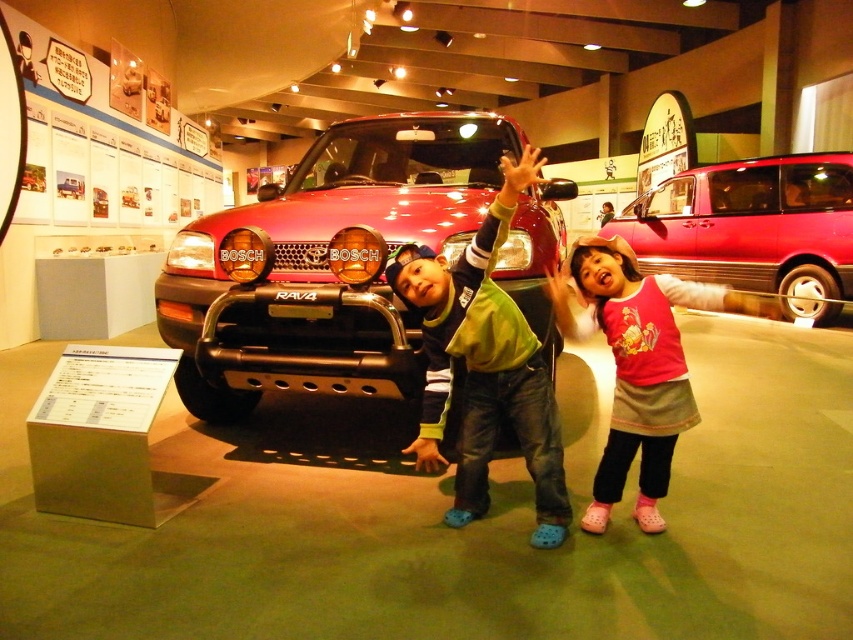
Question: Observing the image, what is the correct spatial positioning of green denim jeans at center in reference to metallic red pickup truck at right?

Choices:
 (A) left
 (B) right

Answer: (A)

Question: Which object is farther from the camera taking this photo?

Choices:
 (A) green denim jeans at center
 (B) pink fabric dress at center

Answer: (B)

Question: Where is green denim jeans at center located in relation to pink fabric dress at center in the image?

Choices:
 (A) right
 (B) left

Answer: (B)

Question: Among these objects, which one is nearest to the camera?

Choices:
 (A) pink fabric dress at center
 (B) shiny red suv at center
 (C) metallic red pickup truck at right
 (D) green denim jeans at center

Answer: (D)

Question: Among these objects, which one is nearest to the camera?

Choices:
 (A) pink fabric dress at center
 (B) metallic red pickup truck at right
 (C) green denim jeans at center
 (D) shiny red suv at center

Answer: (C)

Question: Observing the image, what is the correct spatial positioning of green denim jeans at center in reference to metallic red pickup truck at right?

Choices:
 (A) right
 (B) left

Answer: (B)